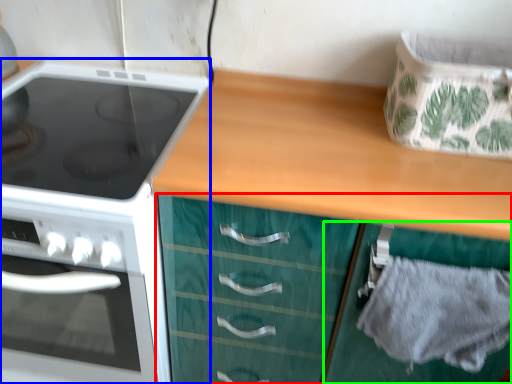
Question: Which object is the farthest from cabinetry (highlighted by a red box)? Choose among these: kitchen appliance (highlighted by a blue box) or cabinetry (highlighted by a green box).

Choices:
 (A) kitchen appliance
 (B) cabinetry

Answer: (A)